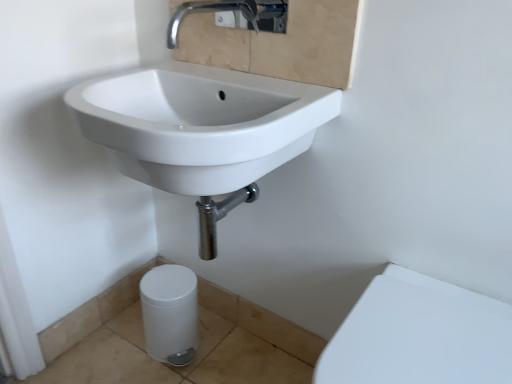
Question: Would you say white glossy porcelain at lower right, the second porcelain positioned from the back, is inside or outside white glossy sink at upper left?

Choices:
 (A) outside
 (B) inside

Answer: (A)

Question: In terms of height, does white glossy porcelain at lower right, the second porcelain positioned from the back, look taller or shorter compared to white glossy sink at upper left?

Choices:
 (A) short
 (B) tall

Answer: (B)

Question: Estimate the real-world distances between objects in this image. Which object is farther from the white glossy porcelain at lower right, marked as the first porcelain in a front-to-back arrangement?

Choices:
 (A) white glossy sink at upper left
 (B) chrome metallic faucet at upper center
 (C) white glossy trash can at lower left, the first porcelain viewed from the left

Answer: (B)

Question: Which object is the farthest from the white glossy sink at upper left?

Choices:
 (A) white glossy porcelain at lower right, which is the first porcelain in right-to-left order
 (B) chrome metallic faucet at upper center
 (C) white glossy trash can at lower left, which ranks as the first porcelain in back-to-front order

Answer: (A)